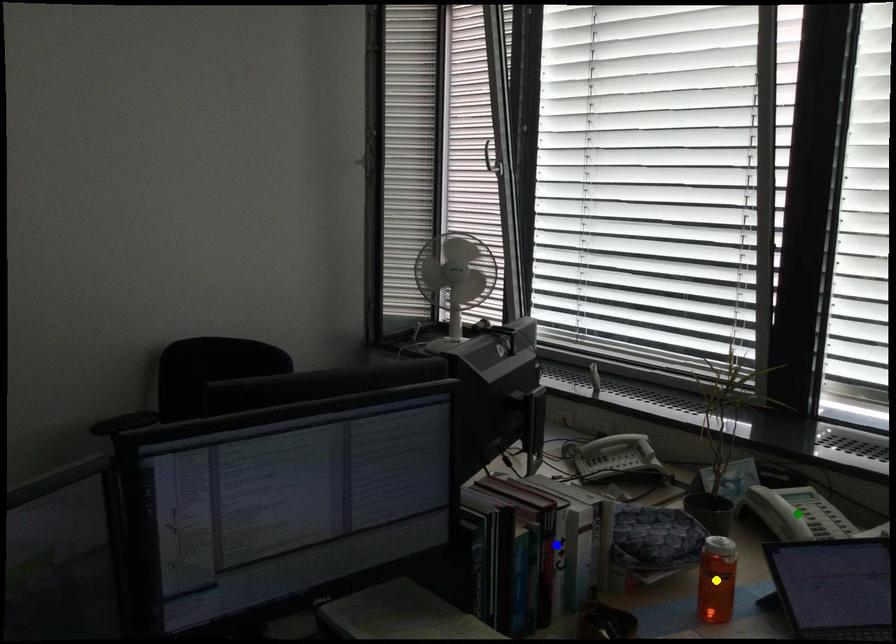
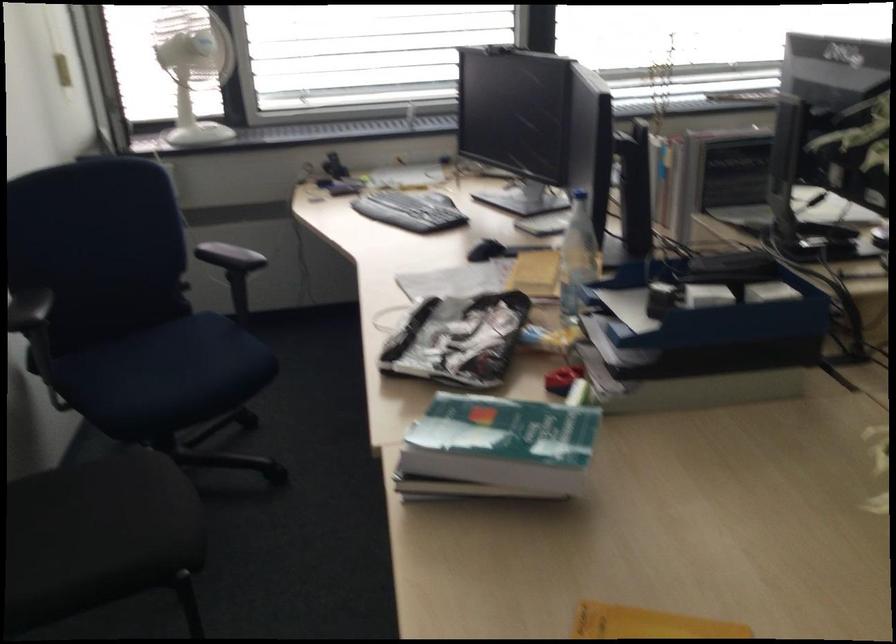
I am providing you with two images of the same scene from different viewpoints. Three points are marked in image1. Which point corresponds to a part or object that is occluded in image2?In image1, three points are marked. Which of them correspond to a part or object that is occluded in image2?Among the three points shown in image1, which one corresponds to a part or object that is no longer visible due to occlusion in image2?

Invisible in image2: green point, blue point, yellow point.